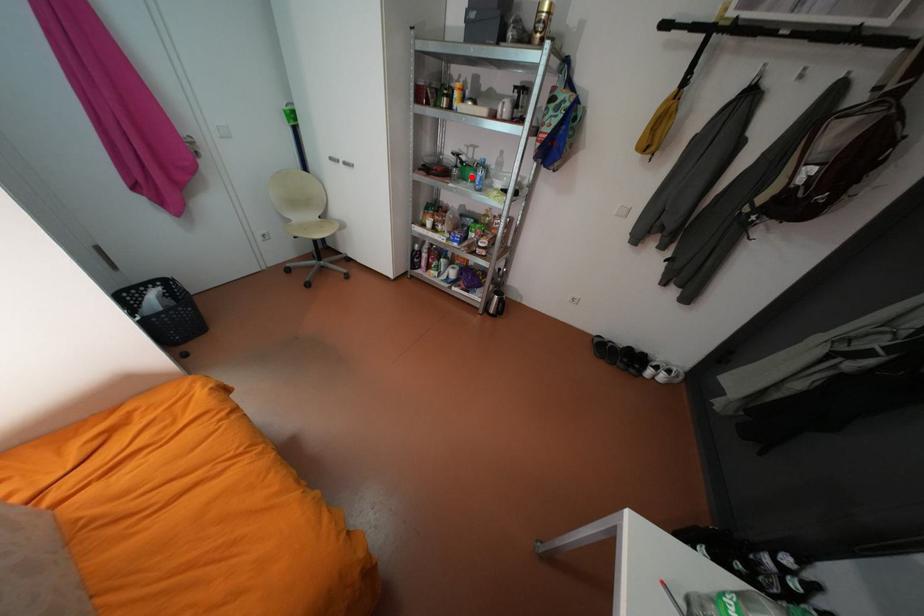
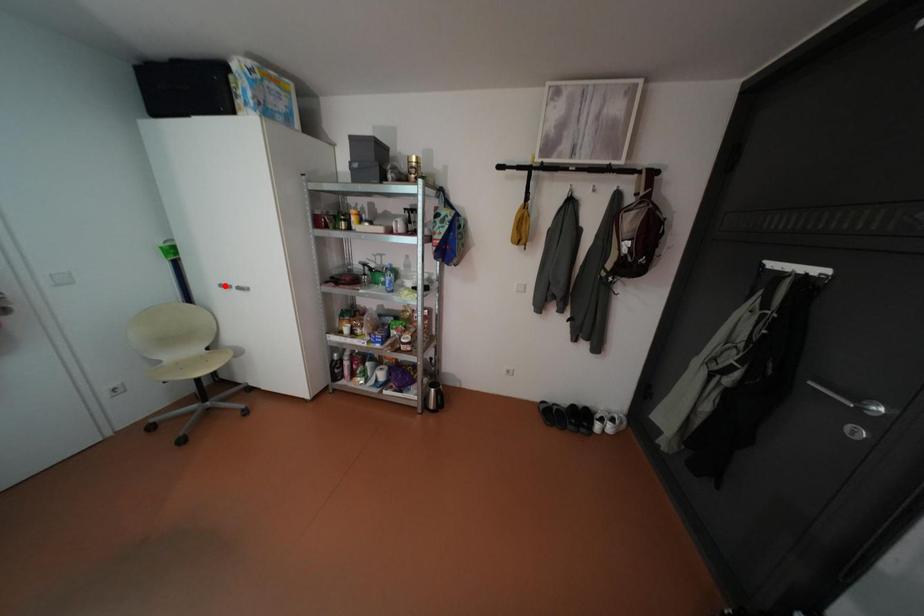
I am providing you with two images of the same scene from different viewpoints. A red point is marked on the first image and another point is marked on the second image. Do the highlighted points in image1 and image2 indicate the same real-world spot?

No